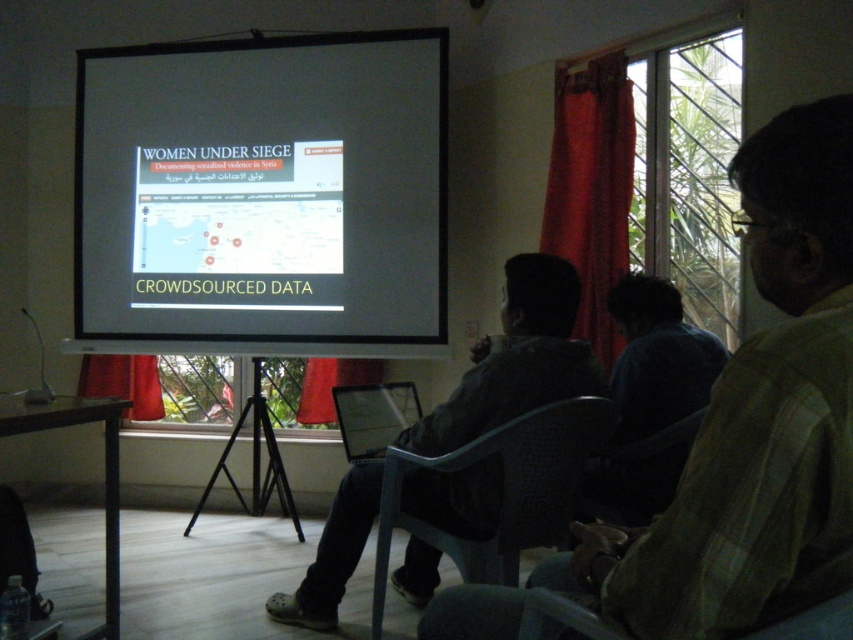
Question: Among these points, which one is nearest to the camera?

Choices:
 (A) (610, 515)
 (B) (328, 365)

Answer: (A)

Question: Does light brown shirt at center have a larger size compared to matte plastic chair at lower right?

Choices:
 (A) yes
 (B) no

Answer: (A)

Question: Which point appears closest to the camera in this image?

Choices:
 (A) (376, 388)
 (B) (683, 428)
 (C) (315, 403)
 (D) (810, 634)

Answer: (D)

Question: Among these points, which one is farthest from the camera?

Choices:
 (A) (381, 611)
 (B) (158, 120)

Answer: (B)

Question: Does light brown shirt at center appear on the right side of matte plastic chair at lower right?

Choices:
 (A) yes
 (B) no

Answer: (B)

Question: Is dark gray plastic chair at center further to camera compared to red fabric curtain at left?

Choices:
 (A) yes
 (B) no

Answer: (B)